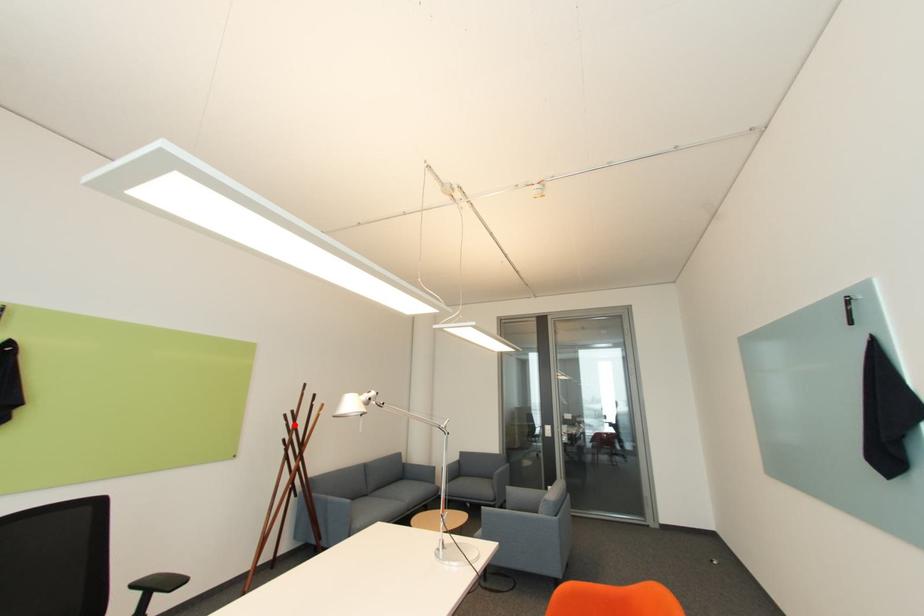
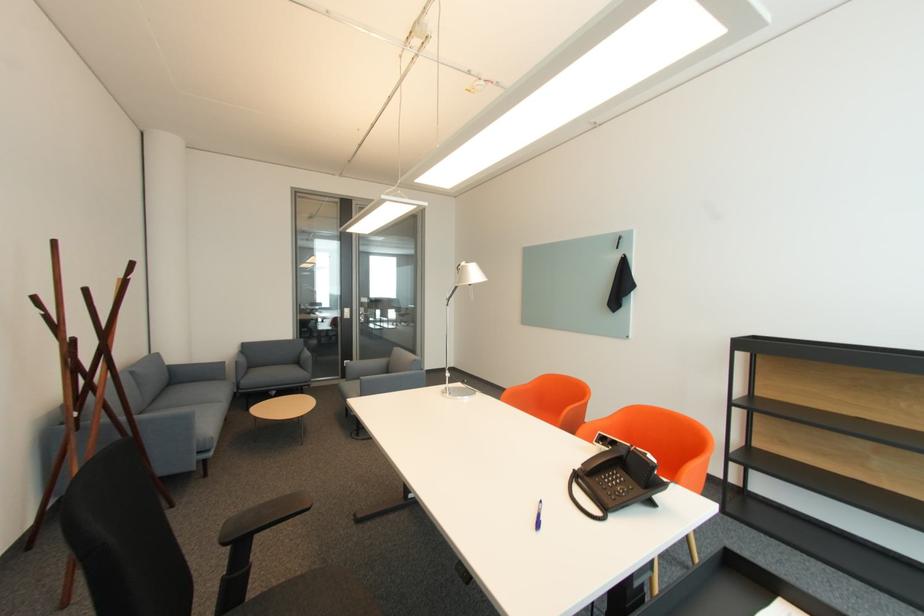
The point at the highlighted location is marked in the first image. Where is the corresponding point in the second image?

(53, 315)